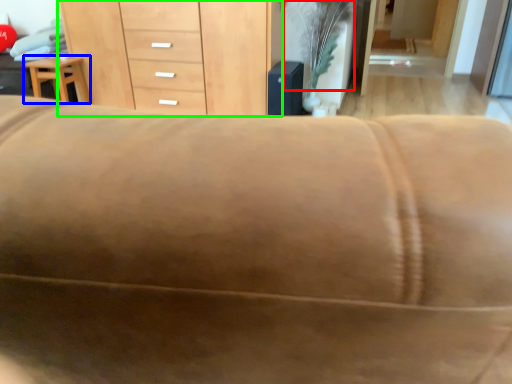
Question: Estimate the real-world distances between objects in this image. Which object is closer to plant (highlighted by a red box), furniture (highlighted by a blue box) or chest of drawers (highlighted by a green box)?

Choices:
 (A) furniture
 (B) chest of drawers

Answer: (B)